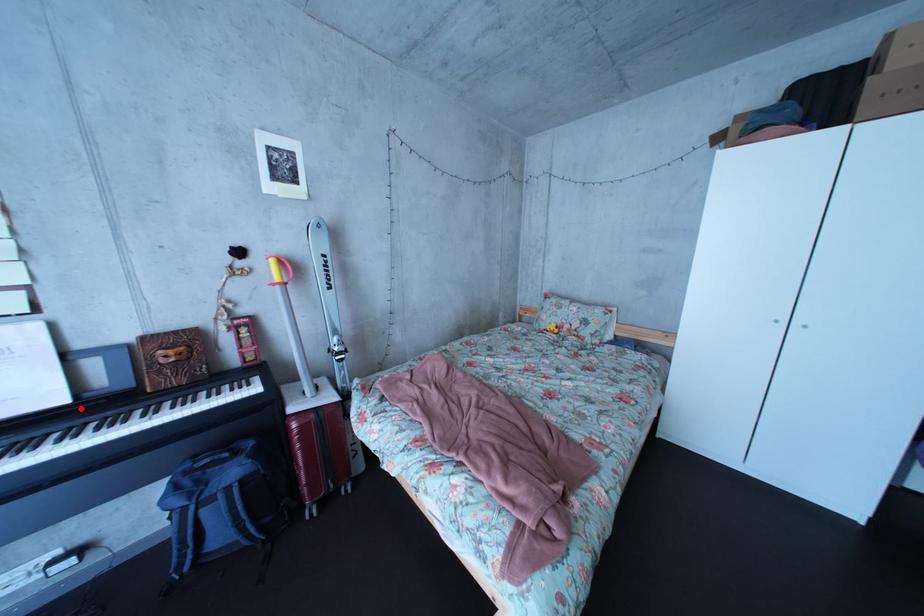
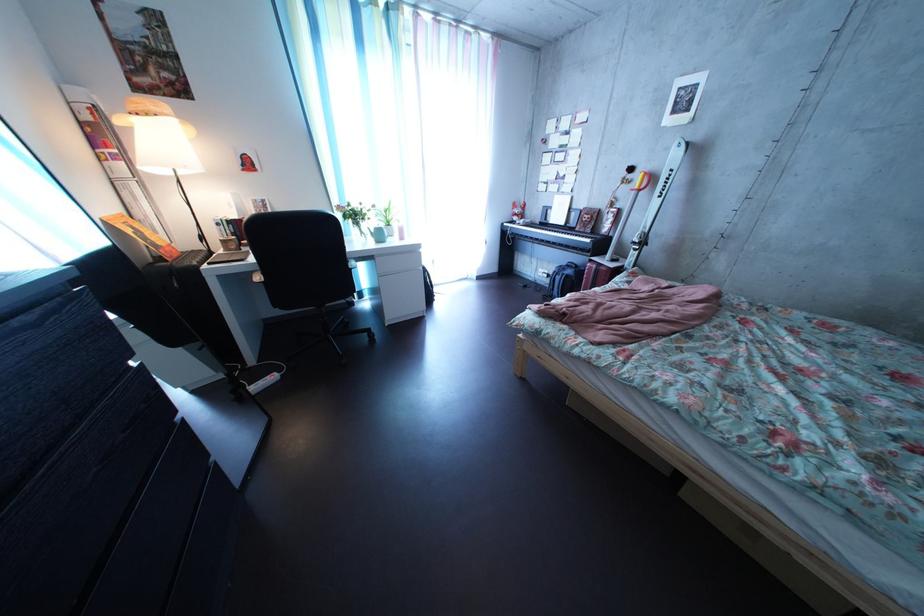
Find the pixel in the second image that matches the highlighted location in the first image.

(577, 232)